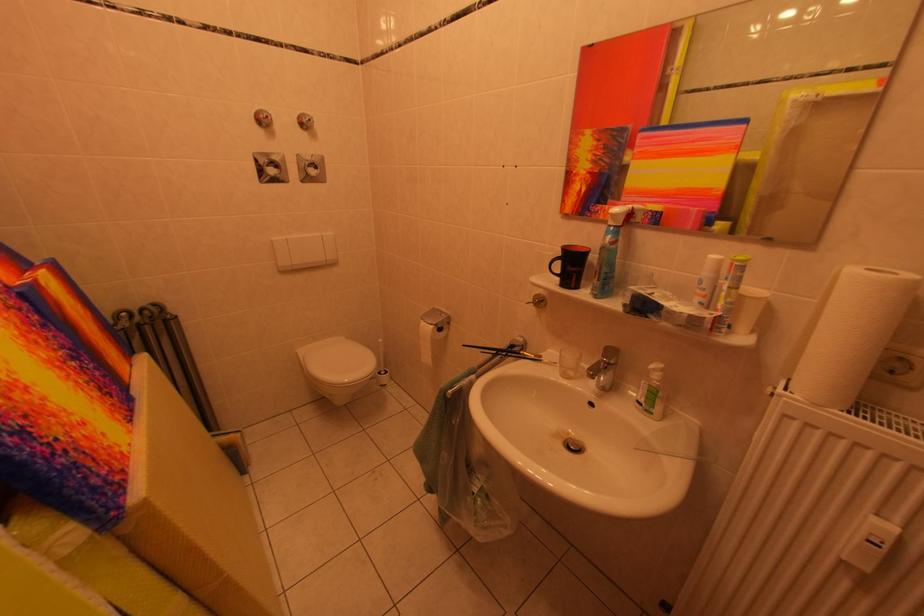
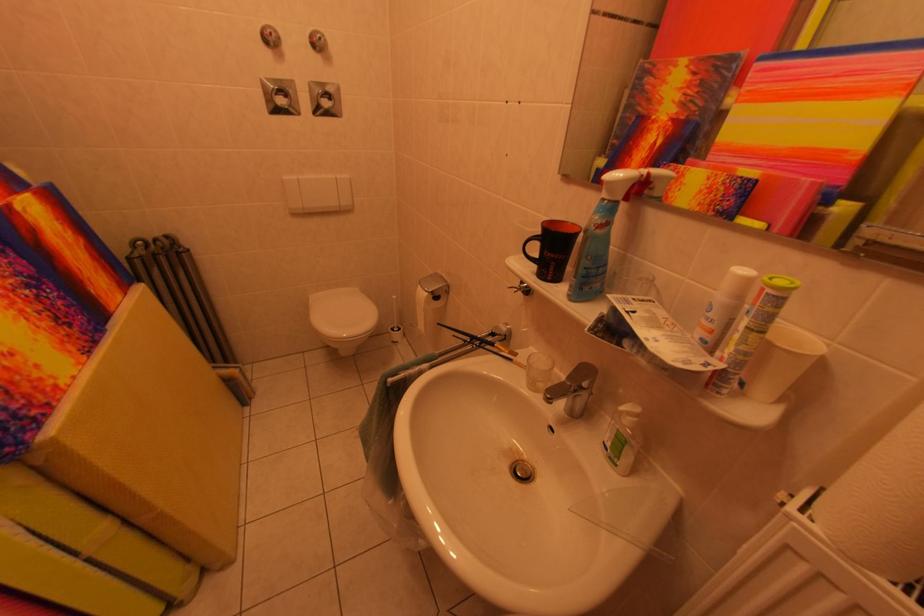
Find the pixel in the second image that matches pixel 574 379 in the first image.

(541, 389)